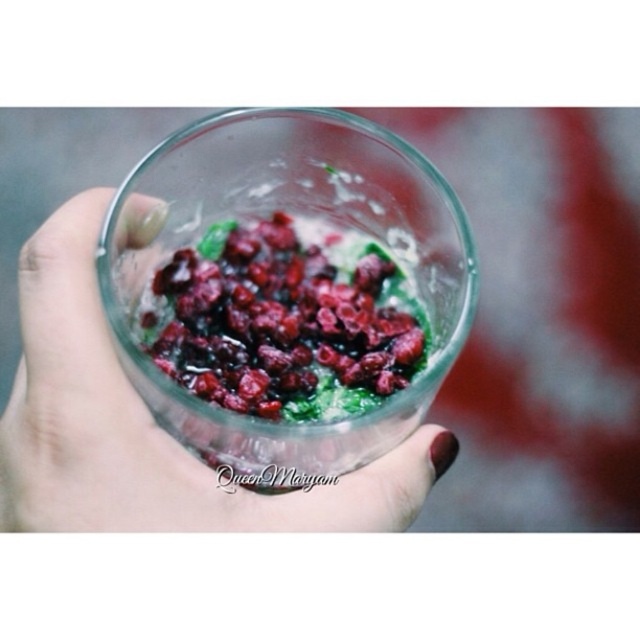
You are a bartender preparing a drink. You have a clear glass cup at center and glossy red berries at center. Which object is taller?

The clear glass cup at center is much taller than the glossy red berries at center.

You are a bartender preparing a drink and need to place the clear glass cup at center and the glossy red berries at center on a shelf. If the shelf has limited space, which object should you place first to ensure both fit properly?

You should place the glossy red berries at center first because the clear glass cup at center is to the left of them, so positioning the berries first allows the cup to be placed to their left without overlapping.

You are a bartender mixing drinks and need to place a garnish on top of the clear glass cup at center. Given that the cup is at position point [147,426], where should you aim to place the garnish?

The garnish should be placed at point [147,426], which corresponds to the clear glass cup at center.